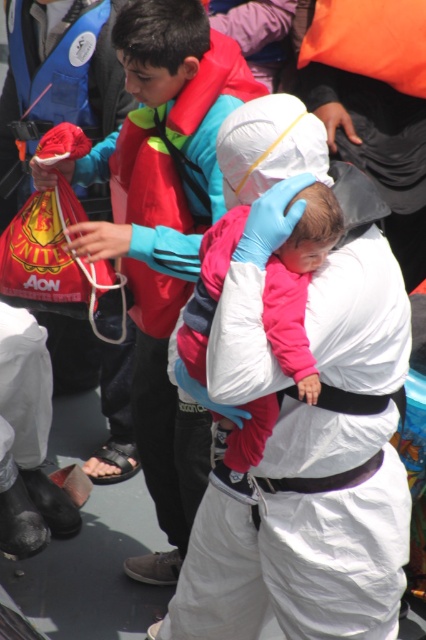
Question: Which object appears farthest from the camera in this image?

Choices:
 (A) red nylon life jacket at upper center
 (B) pink fleece jacket at center

Answer: (A)

Question: Which point appears farthest from the camera in this image?

Choices:
 (A) (221, 211)
 (B) (224, 481)

Answer: (A)

Question: Is red nylon life jacket at upper center smaller than pink fleece jacket at center?

Choices:
 (A) no
 (B) yes

Answer: (A)

Question: Is red nylon life jacket at upper center bigger than pink fleece jacket at center?

Choices:
 (A) yes
 (B) no

Answer: (A)

Question: Which object appears closest to the camera in this image?

Choices:
 (A) pink fleece jacket at center
 (B) red nylon life jacket at upper center

Answer: (A)

Question: Is red nylon life jacket at upper center closer to camera compared to pink fleece jacket at center?

Choices:
 (A) no
 (B) yes

Answer: (A)